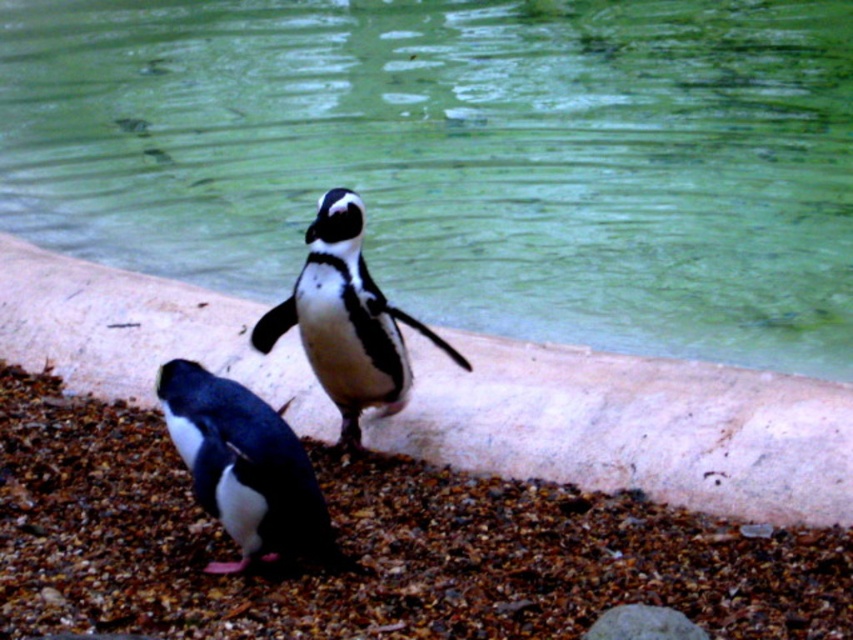
In the scene shown: Which is more to the left, white stone ledge at center or gray rough stone at lower center?

Positioned to the left is white stone ledge at center.

Where is `white stone ledge at center`? The image size is (853, 640). white stone ledge at center is located at coordinates (631, 428).

The height and width of the screenshot is (640, 853). I want to click on white stone ledge at center, so click(x=631, y=428).

Does white stone ledge at center have a greater height compared to black matte penguin at lower left?

Yes, white stone ledge at center is taller than black matte penguin at lower left.

Who is more distant from viewer, (583,381) or (192,387)?

The point (583,381) is more distant.

Find the location of a particular element. This screenshot has height=640, width=853. white stone ledge at center is located at coordinates (631, 428).

Which of these two, black and white feathers at center or gray rough stone at lower center, stands shorter?

gray rough stone at lower center

Between black and white feathers at center and gray rough stone at lower center, which one has more height?

Standing taller between the two is black and white feathers at center.

Between point (355, 442) and point (680, 625), which one is positioned behind?

Point (355, 442)

I want to click on black and white feathers at center, so click(346, 320).